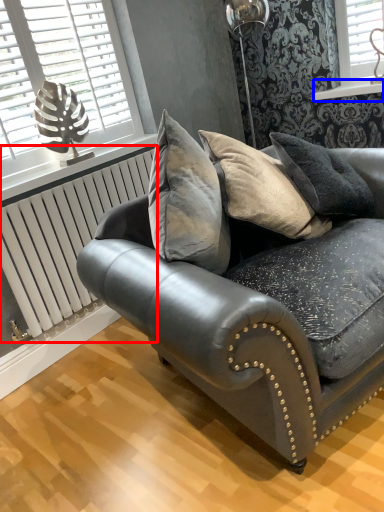
Question: Which object is closer to the camera taking this photo, radiator (highlighted by a red box) or window sill (highlighted by a blue box)?

Choices:
 (A) radiator
 (B) window sill

Answer: (A)